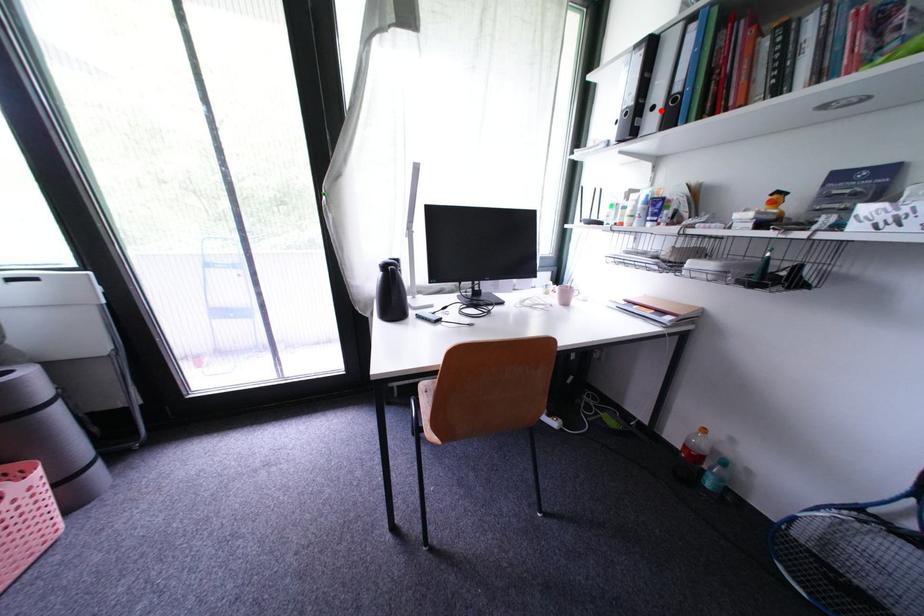
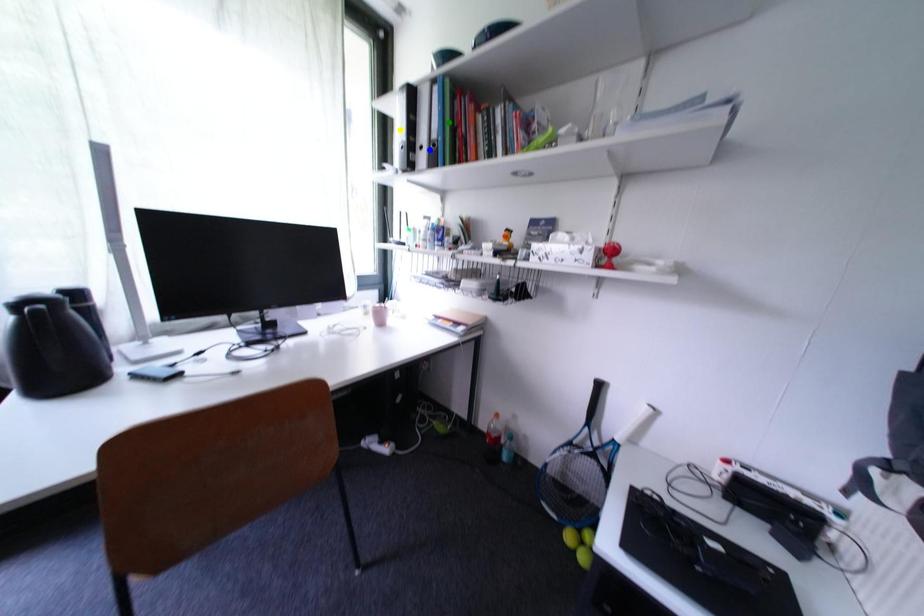
Question: I am providing you with two images of the same scene from different viewpoints. A red point is marked on the first image. You are given multiple points on the second image. Which point in image 2 represents the same 3d spot as the red point in image 1?

Choices:
 (A) blue point
 (B) green point
 (C) yellow point

Answer: (A)